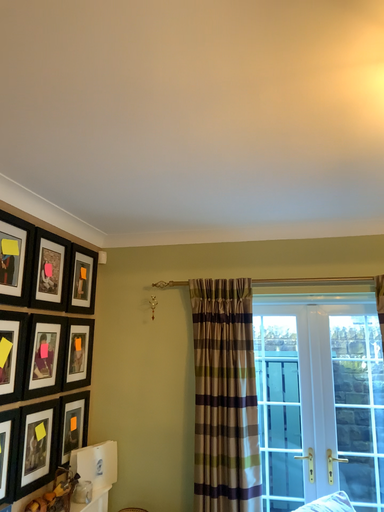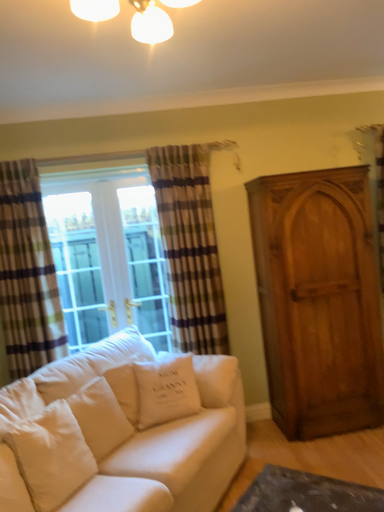
Question: How did the camera likely rotate when shooting the video?

Choices:
 (A) rotated left
 (B) rotated right

Answer: (B)